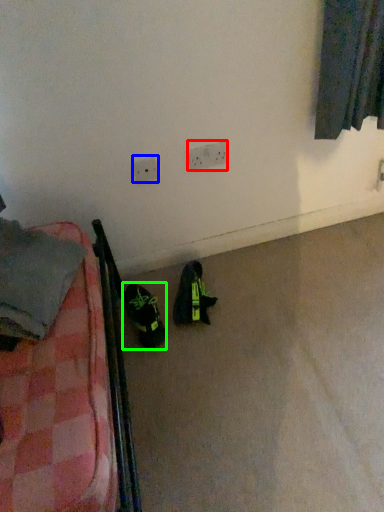
Question: Estimate the real-world distances between objects in this image. Which object is farther from electric outlet (highlighted by a red box), electric outlet (highlighted by a blue box) or footwear (highlighted by a green box)?

Choices:
 (A) electric outlet
 (B) footwear

Answer: (B)